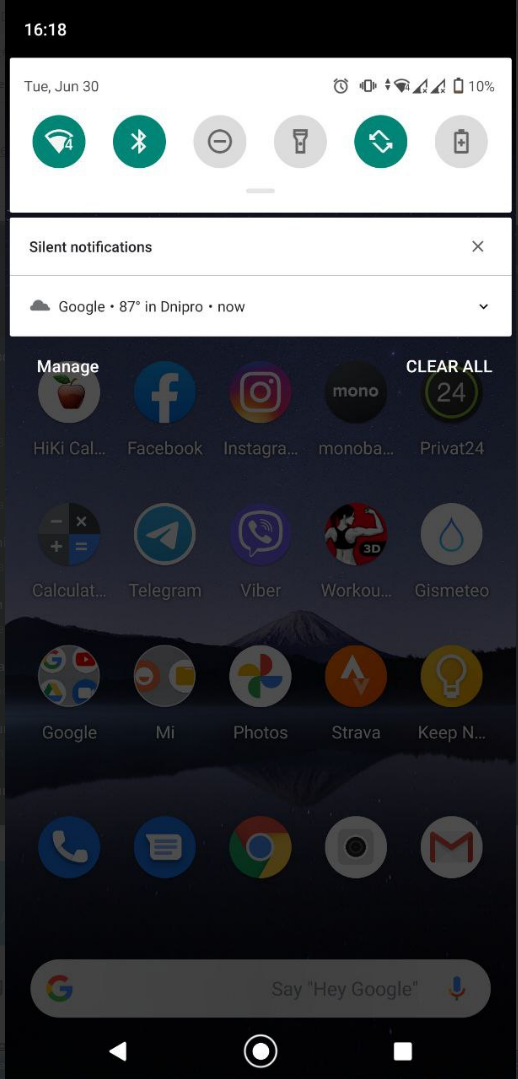
At what (x,y) coordinates should I click in order to perform the action: click on clock\. Please return your answer as a coordinate pair (x, y). Looking at the image, I should click on (55, 32).